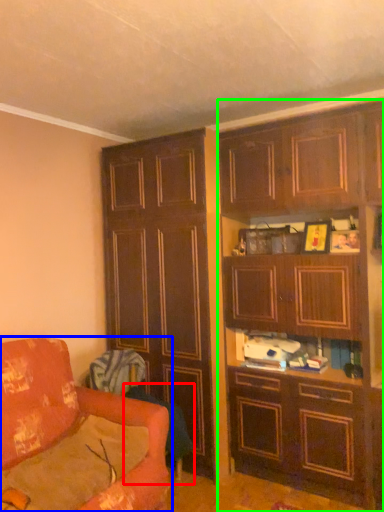
Question: Estimate the real-world distances between objects in this image. Which object is farther from swivel chair (highlighted by a red box), studio couch (highlighted by a blue box) or cabinetry (highlighted by a green box)?

Choices:
 (A) studio couch
 (B) cabinetry

Answer: (B)